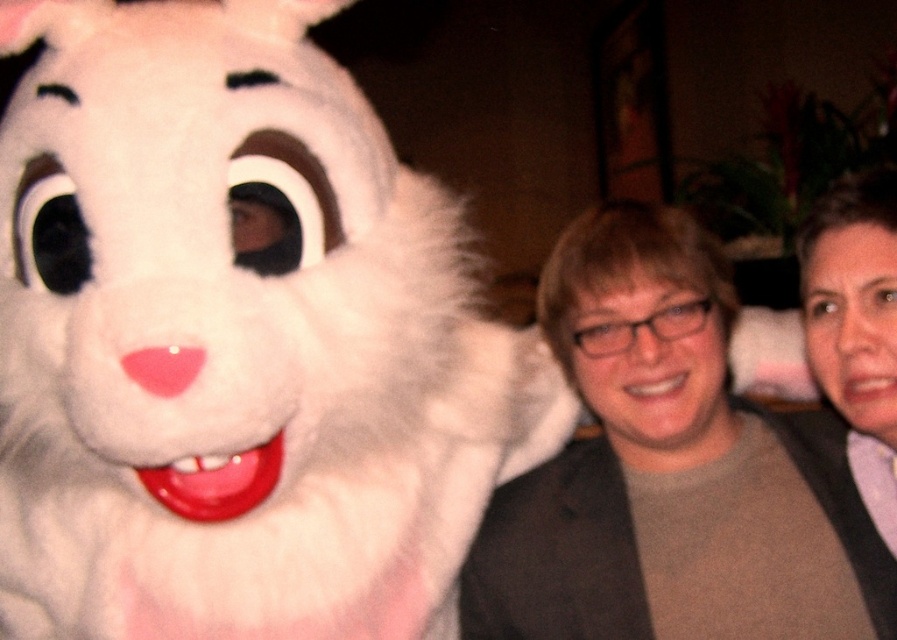
Question: Does fluffy white bunny at left have a larger size compared to matte gray jacket at center?

Choices:
 (A) no
 (B) yes

Answer: (B)

Question: Estimate the real-world distances between objects in this image. Which object is farther from the fluffy white bunny at left?

Choices:
 (A) matte gray jacket at center
 (B) matte gray sweater at center

Answer: (B)

Question: Does matte gray jacket at center have a smaller size compared to matte gray sweater at center?

Choices:
 (A) yes
 (B) no

Answer: (B)

Question: Among these points, which one is nearest to the camera?

Choices:
 (A) (25, 609)
 (B) (864, 525)
 (C) (803, 481)

Answer: (A)

Question: Observing the image, what is the correct spatial positioning of fluffy white bunny at left in reference to matte gray jacket at center?

Choices:
 (A) below
 (B) above

Answer: (B)

Question: Based on their relative distances, which object is farther from the matte gray sweater at center?

Choices:
 (A) fluffy white bunny at left
 (B) matte gray jacket at center

Answer: (A)